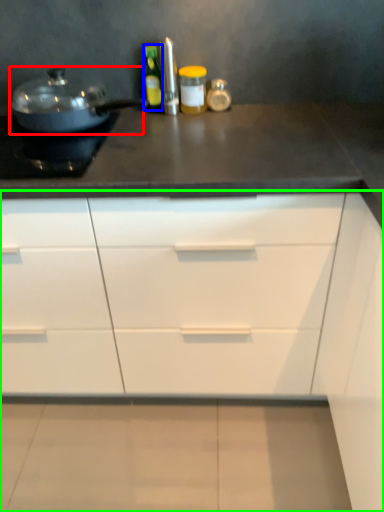
Question: Which object is positioned farthest from kitchen appliance (highlighted by a red box)? Select from bottle (highlighted by a blue box) and cabinetry (highlighted by a green box).

Choices:
 (A) bottle
 (B) cabinetry

Answer: (B)